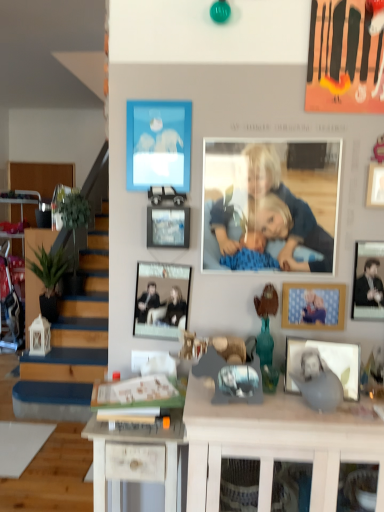
Question: From a real-world perspective, is metallic black picture frame at center, the fourth picture frame in the bottom-to-top sequence, below wooden picture frame at center-right, the 4th picture frame from the top?

Choices:
 (A) no
 (B) yes

Answer: (A)

Question: Is metallic black picture frame at center, which is the second picture frame in top-to-bottom order, beside wooden picture frame at center-right, the 4th picture frame from the top?

Choices:
 (A) no
 (B) yes

Answer: (A)

Question: From the image's perspective, is metallic black picture frame at center, the fourth picture frame in the bottom-to-top sequence, on top of wooden picture frame at center-right, which appears as the 2th picture frame when ordered from the bottom?

Choices:
 (A) yes
 (B) no

Answer: (A)

Question: Can you confirm if metallic black picture frame at center, which is the second picture frame in top-to-bottom order, is wider than wooden picture frame at center-right, which appears as the 2th picture frame when ordered from the bottom?

Choices:
 (A) yes
 (B) no

Answer: (A)

Question: Is metallic black picture frame at center, the fourth picture frame in the bottom-to-top sequence, at the left side of wooden picture frame at center-right, which appears as the 2th picture frame when ordered from the bottom?

Choices:
 (A) yes
 (B) no

Answer: (A)

Question: From a real-world perspective, is matte blue picture frame at upper center, the first picture frame positioned from the top, physically located above or below white wood cabinet at lower left?

Choices:
 (A) above
 (B) below

Answer: (A)

Question: Is matte blue picture frame at upper center, positioned as the 5th picture frame in bottom-to-top order, in front of or behind white wood cabinet at lower left in the image?

Choices:
 (A) behind
 (B) front

Answer: (B)

Question: In terms of height, does matte blue picture frame at upper center, the first picture frame positioned from the top, look taller or shorter compared to white wood cabinet at lower left?

Choices:
 (A) short
 (B) tall

Answer: (A)

Question: Is matte blue picture frame at upper center, the first picture frame positioned from the top, to the left or to the right of white wood cabinet at lower left in the image?

Choices:
 (A) right
 (B) left

Answer: (A)

Question: From a real-world perspective, relative to white wood desk at center, the 2th desk viewed from the left, is white wood cabinet at lower left vertically above or below?

Choices:
 (A) below
 (B) above

Answer: (A)

Question: Looking at their shapes, would you say white wood cabinet at lower left is wider or thinner than white wood desk at center, positioned as the first desk in right-to-left order?

Choices:
 (A) wide
 (B) thin

Answer: (B)

Question: Relative to white wood desk at center, positioned as the first desk in right-to-left order, is white wood cabinet at lower left in front or behind?

Choices:
 (A) behind
 (B) front

Answer: (A)

Question: Considering the positions of white wood cabinet at lower left and white wood desk at center, the 2th desk viewed from the left, in the image, is white wood cabinet at lower left taller or shorter than white wood desk at center, the 2th desk viewed from the left,?

Choices:
 (A) short
 (B) tall

Answer: (B)

Question: From a real-world perspective, is blue fabric at center physically located above or below metallic black picture frame at center, which is the second picture frame in top-to-bottom order?

Choices:
 (A) below
 (B) above

Answer: (B)

Question: From the image's perspective, is blue fabric at center positioned above or below metallic black picture frame at center, the fourth picture frame in the bottom-to-top sequence?

Choices:
 (A) above
 (B) below

Answer: (A)